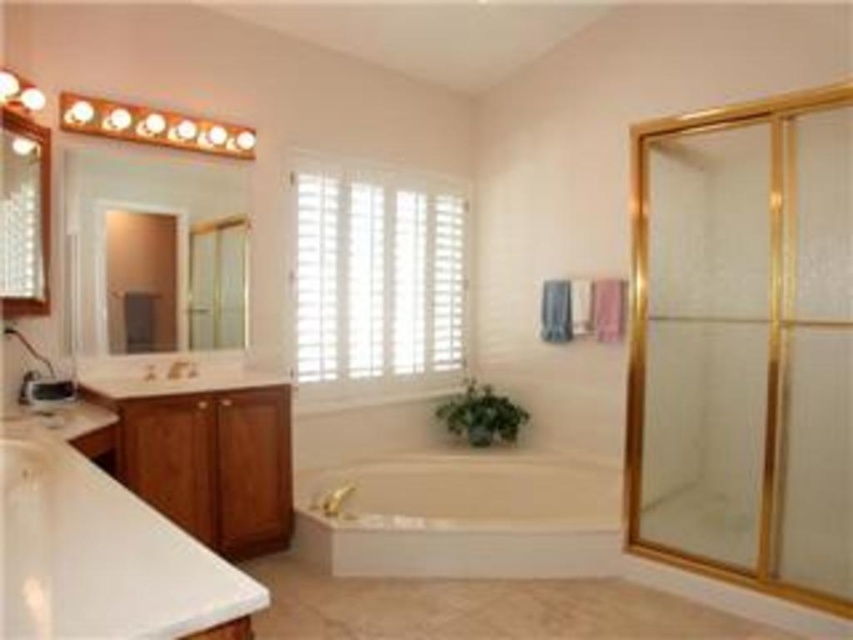
Question: Which object is the farthest from the brushed metal faucet at left?

Choices:
 (A) matte wooden mirror at upper left
 (B) white glossy countertop at lower left
 (C) wooden counter top at lower left

Answer: (B)

Question: Is clear glass shower door at right thinner than wooden counter top at lower left?

Choices:
 (A) no
 (B) yes

Answer: (B)

Question: Which point is farther to the camera?

Choices:
 (A) white glossy countertop at lower left
 (B) wooden counter top at lower left

Answer: (B)

Question: Is wooden counter top at lower left positioned in front of brushed metal faucet at left?

Choices:
 (A) no
 (B) yes

Answer: (B)

Question: Which point is closer to the camera?

Choices:
 (A) white glossy bathtub at center
 (B) white glossy countertop at lower left
 (C) matte wooden mirror at upper left

Answer: (B)

Question: Does clear glass shower door at right appear over white glossy bathtub at center?

Choices:
 (A) yes
 (B) no

Answer: (A)